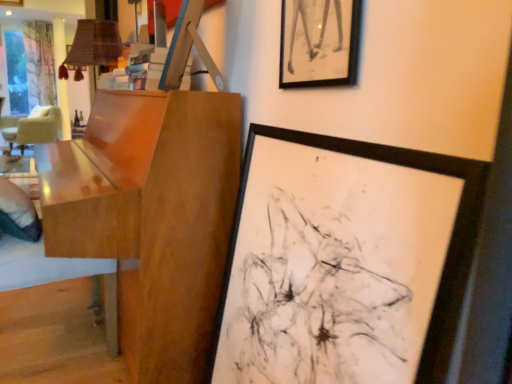
Question: Do you think glossy wood table at left is within black matte picture frame at center, the 2th picture frame viewed from the top, or outside of it?

Choices:
 (A) inside
 (B) outside

Answer: (B)

Question: Relative to black matte picture frame at center, marked as the 1th picture frame in a bottom-to-top arrangement, is glossy wood table at left in front or behind?

Choices:
 (A) behind
 (B) front

Answer: (A)

Question: Which object is positioned closest to the glossy wood table at left?

Choices:
 (A) black matte picture frame at center, the 2th picture frame viewed from the top
 (B) beige fabric chair at left
 (C) black matte picture frame at upper center, the 1th picture frame positioned from the top

Answer: (A)

Question: Considering the real-world distances, which object is closest to the black matte picture frame at center, the 2th picture frame viewed from the top?

Choices:
 (A) black matte picture frame at upper center, the 1th picture frame positioned from the top
 (B) glossy wood table at left
 (C) beige fabric chair at left

Answer: (A)